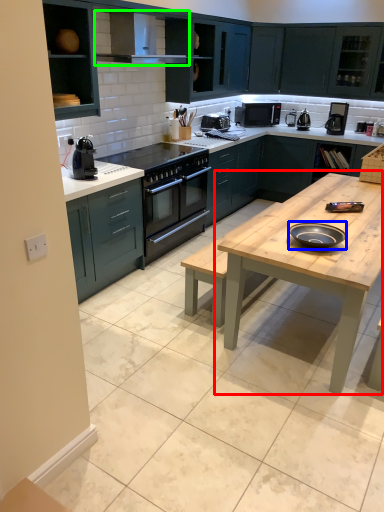
Question: Which object is the farthest from table (highlighted by a red box)? Choose among these: pizza pan (highlighted by a blue box) or exhaust hood (highlighted by a green box).

Choices:
 (A) pizza pan
 (B) exhaust hood

Answer: (B)